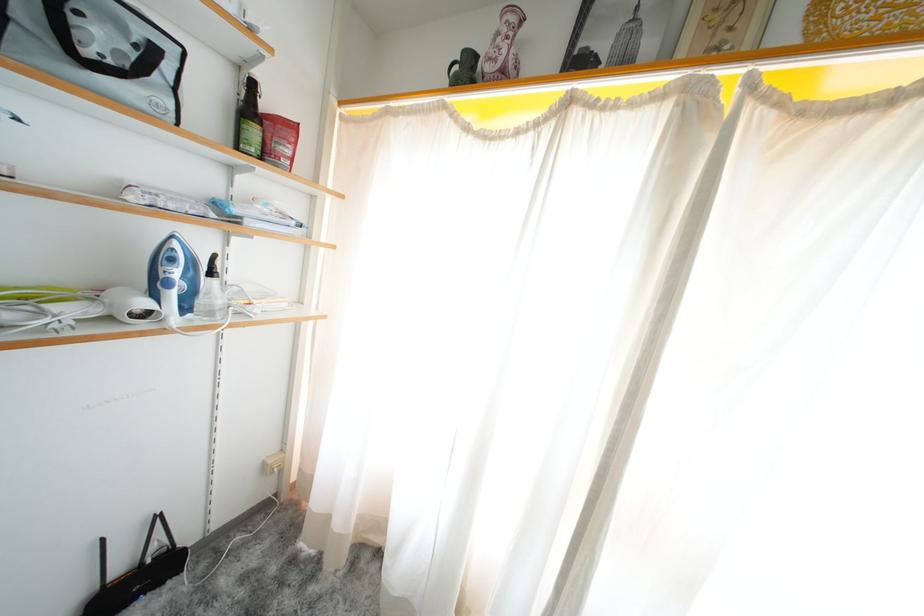
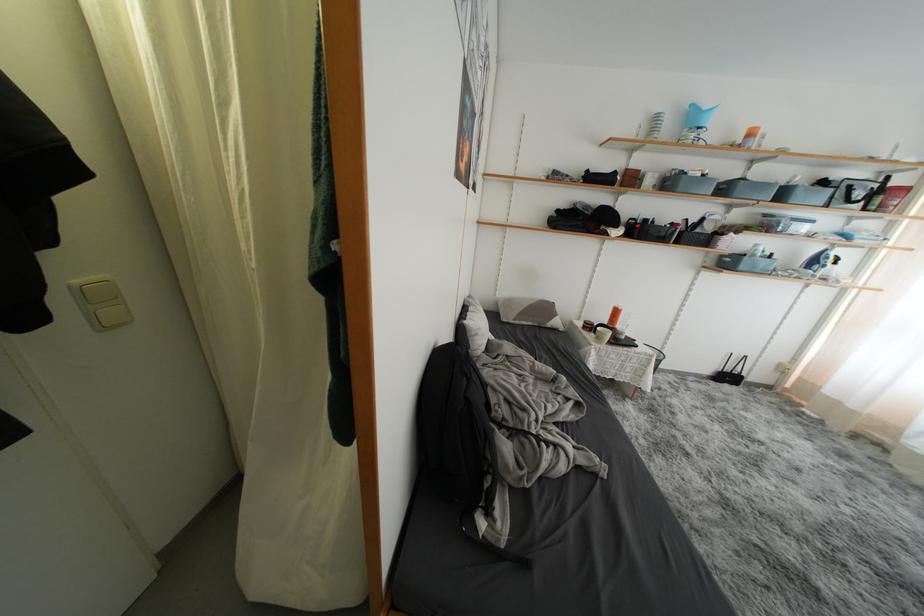
Where in the second image is the point corresponding to point 217,278 from the first image?

(842, 267)